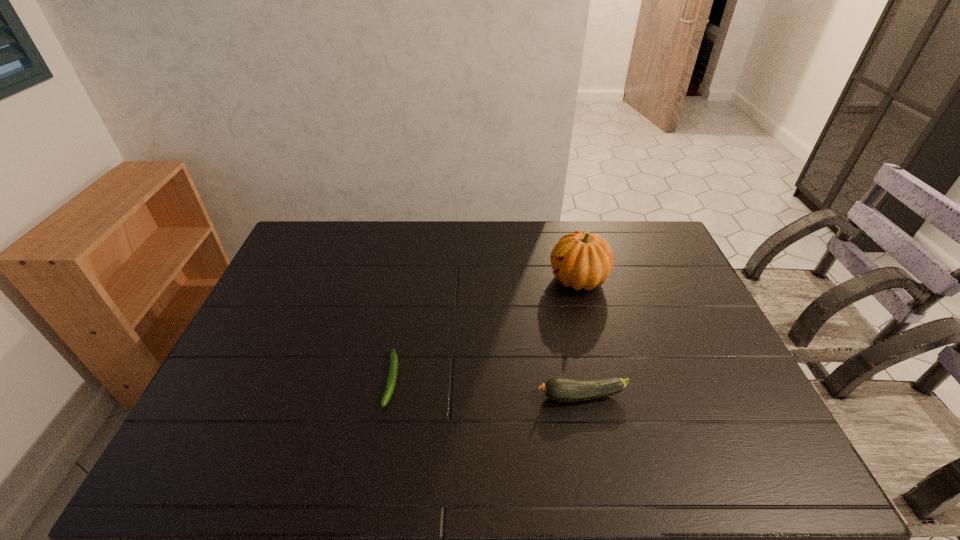
At what (x,y) coordinates should I click in order to perform the action: click on vacant space that is in between the farthest object and the taller zucchini. Please return your answer as a coordinate pair (x, y). The height and width of the screenshot is (540, 960). Looking at the image, I should click on (580, 338).

Where is `free spot between the leftmost object and the farthest object`? free spot between the leftmost object and the farthest object is located at coordinates (485, 329).

This screenshot has width=960, height=540. Find the location of `free point between the left zucchini and the farthest object`. free point between the left zucchini and the farthest object is located at coordinates (485, 329).

The width and height of the screenshot is (960, 540). Identify the location of empty location between the farthest object and the second tallest object. (580, 338).

Find the location of a particular element. vacant area that lies between the second shortest object and the pumpkin is located at coordinates (580, 338).

Image resolution: width=960 pixels, height=540 pixels. Find the location of `blank region between the second tallest object and the farthest object`. blank region between the second tallest object and the farthest object is located at coordinates (580, 338).

You are a GUI agent. You are given a task and a screenshot of the screen. Output one action in this format:
    pyautogui.click(x=<x>, y=<y>)
    Task: Click on the vacant area that lies between the right zucchini and the tallest object
    Image resolution: width=960 pixels, height=540 pixels.
    Given the screenshot: What is the action you would take?
    pyautogui.click(x=580, y=338)

This screenshot has width=960, height=540. I want to click on object identified as the second closest to the shortest object, so click(x=582, y=260).

Point out which object is positioned as the second nearest to the second shortest object. Please provide its 2D coordinates. Your answer should be formatted as a tuple, i.e. [(x, y)], where the tuple contains the x and y coordinates of a point satisfying the conditions above.

[(393, 361)]

At what (x,y) coordinates should I click in order to perform the action: click on free space in the image that satisfies the following two spatial constraints: 1. on the carved face of the tallest object; 2. on the front-facing side of the leftmost object. Please return your answer as a coordinate pair (x, y). Looking at the image, I should click on (604, 380).